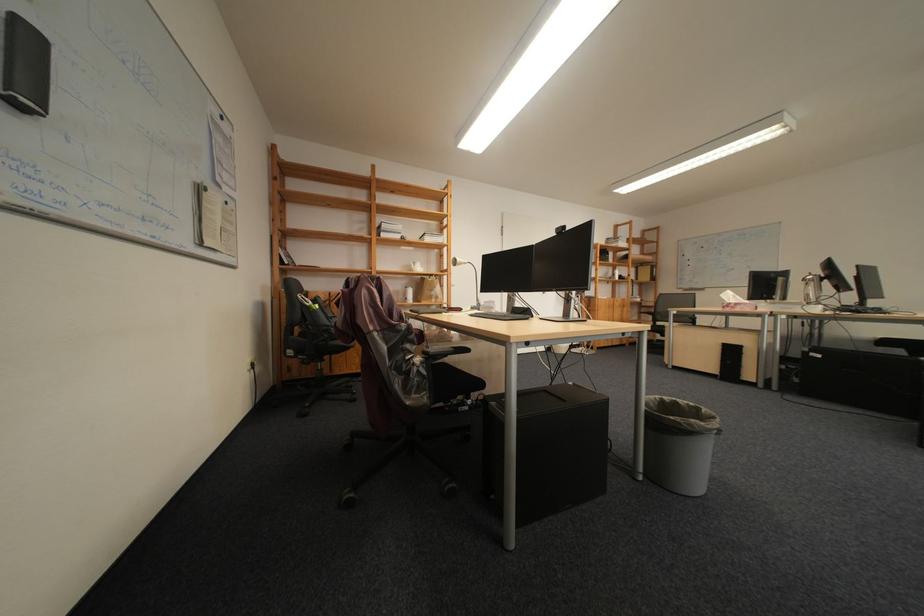
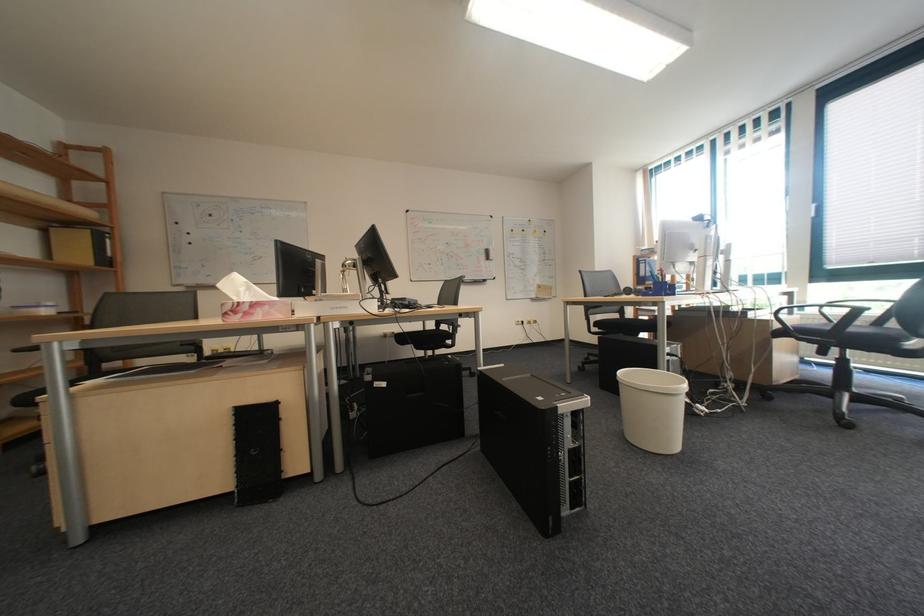
Where in the second image is the point corresponding to point 664,267 from the first image?

(103, 232)